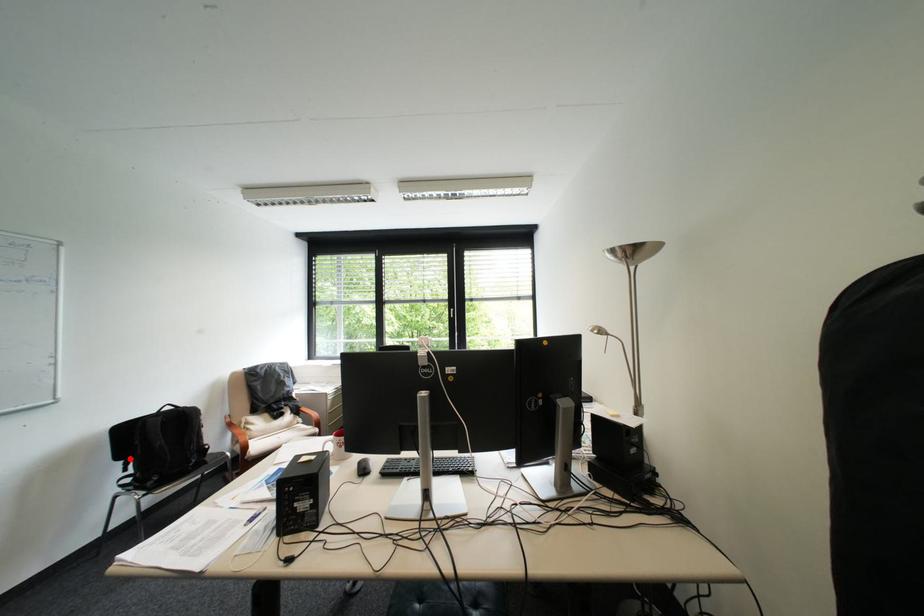
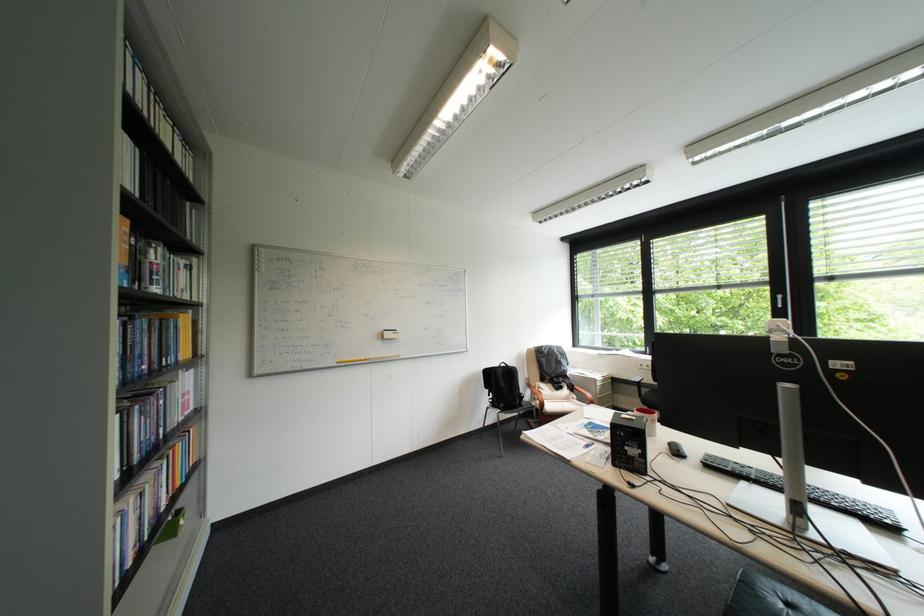
Question: I am providing you with two images of the same scene from different viewpoints. In image1, a red point is highlighted. Considering the same 3D point in image2, which of the following is correct?

Choices:
 (A) It is closer
 (B) It is farther

Answer: (B)